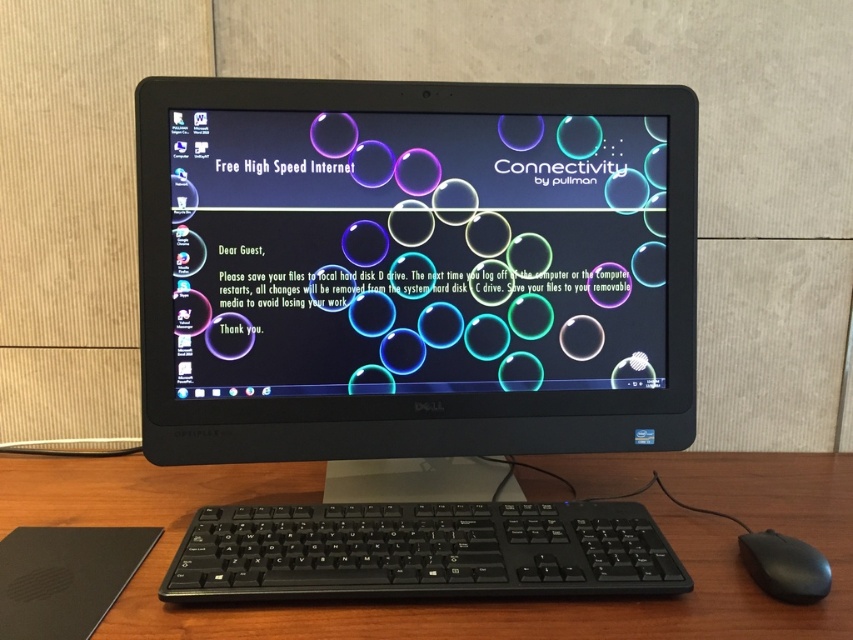
Is black plastic keyboard at center taller than black plastic mouse at lower right?

Yes.

Does point (566, 556) come in front of point (804, 600)?

No.

Where is `black plastic keyboard at center`? The width and height of the screenshot is (853, 640). black plastic keyboard at center is located at coordinates (421, 552).

Can you confirm if black glossy monitor at center is thinner than wooden at center?

Yes.

Which is behind, point (628, 365) or point (704, 486)?

Positioned behind is point (704, 486).

Identify the location of black glossy monitor at center. (413, 268).

Is wooden at center bigger than black plastic mouse at lower right?

Yes, wooden at center is bigger than black plastic mouse at lower right.

Consider the image. Does wooden at center have a lesser height compared to black plastic mouse at lower right?

No.

Does point (119, 460) come in front of point (798, 563)?

No.

I want to click on wooden at center, so click(x=469, y=600).